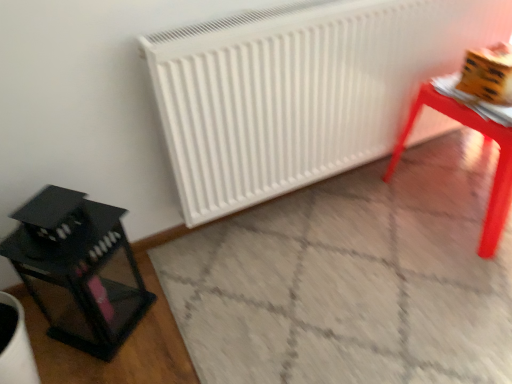
The height and width of the screenshot is (384, 512). Identify the location of free space in front of black glass lantern at left. (92, 366).